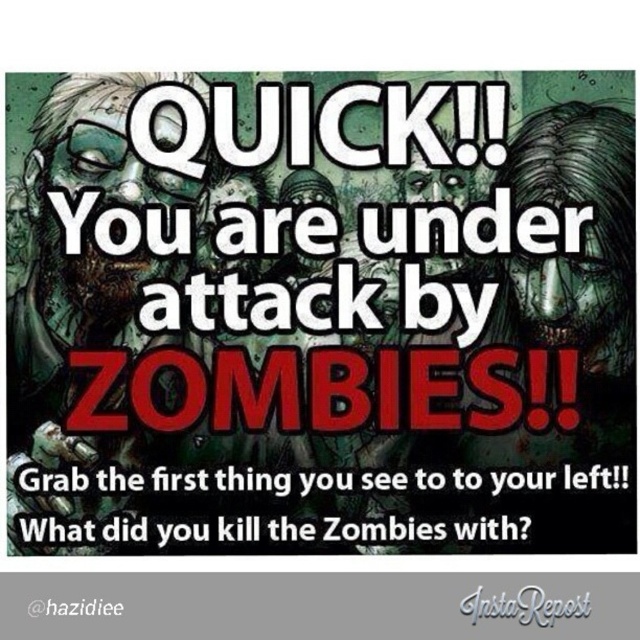
Question: Which is nearer to the graytexturedinstarepost at center?

Choices:
 (A) white paper at center
 (B) red text at lower left

Answer: (A)

Question: Can you confirm if white paper at center is positioned to the right of red text at lower left?

Choices:
 (A) no
 (B) yes

Answer: (B)

Question: Does graytexturedinstarepost at center appear on the right side of red text at lower left?

Choices:
 (A) yes
 (B) no

Answer: (A)

Question: Which of the following is the closest to the observer?

Choices:
 (A) red text at lower left
 (B) white paper at center
 (C) graytexturedinstarepost at center

Answer: (C)

Question: Is white paper at center thinner than red text at lower left?

Choices:
 (A) no
 (B) yes

Answer: (A)

Question: Among these points, which one is farthest from the camera?

Choices:
 (A) (68, 611)
 (B) (500, 602)

Answer: (A)